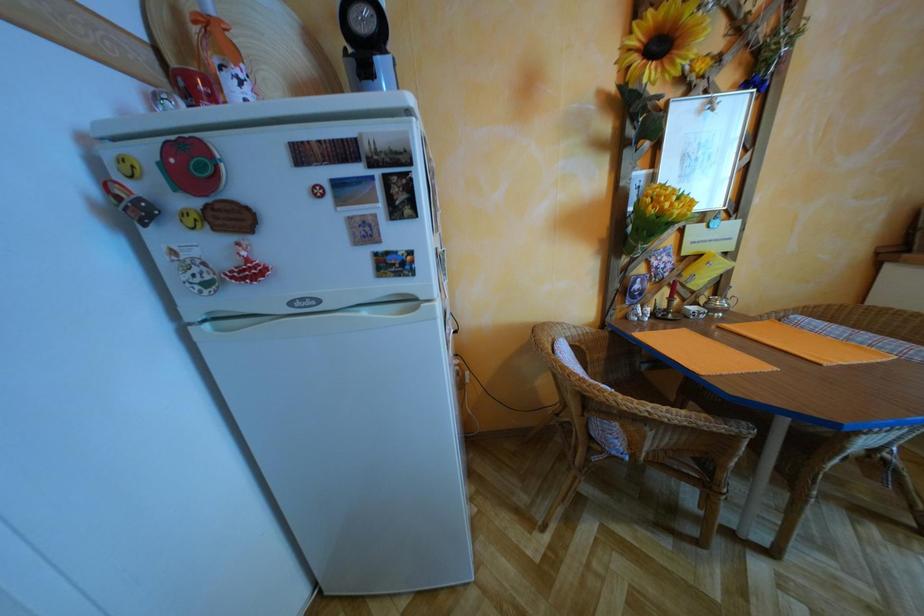
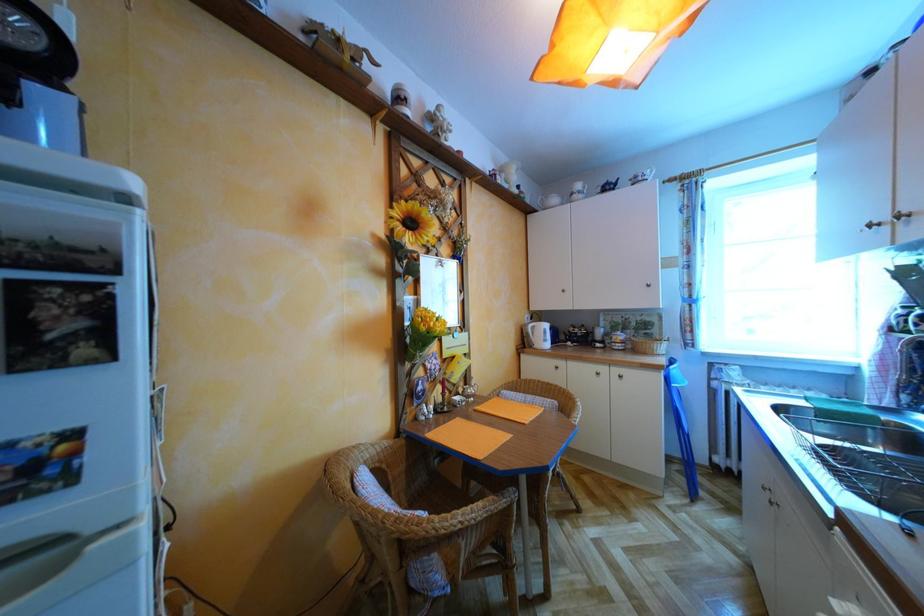
First-person continuous shooting, in which direction is the camera rotating?

The camera rotated toward right-up.